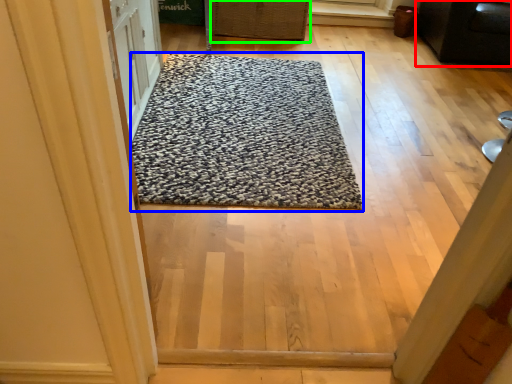
Question: Which object is positioned farthest from furniture (highlighted by a red box)? Select from mat (highlighted by a blue box) and basket (highlighted by a green box).

Choices:
 (A) mat
 (B) basket

Answer: (A)